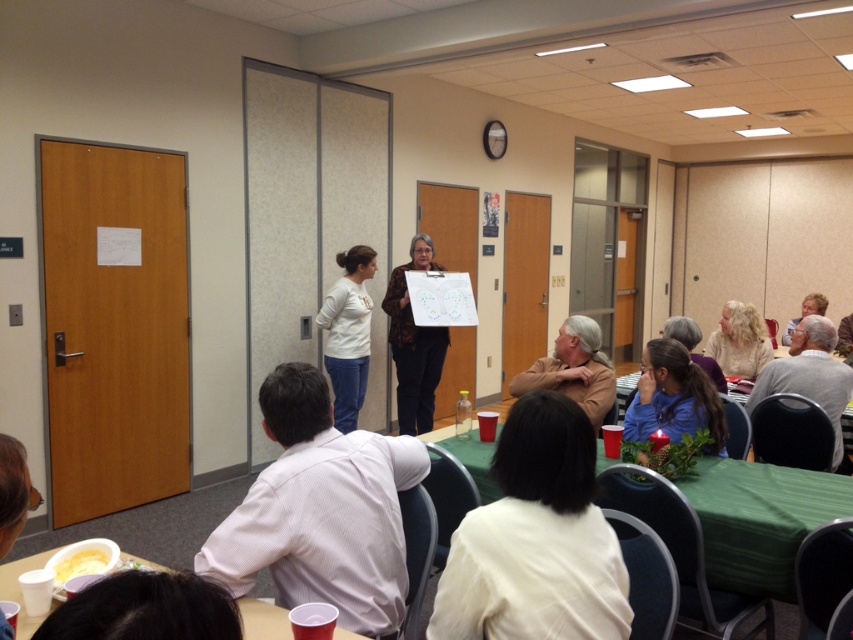
Does point (744, 465) come farther from viewer compared to point (706, 419)?

No, (744, 465) is closer to viewer.

Is green fabric table at lower center bigger than blue matte shirt at lower right?

No, green fabric table at lower center is not bigger than blue matte shirt at lower right.

I want to click on green fabric table at lower center, so click(x=759, y=518).

Does white matte shirt at lower center have a lesser width compared to blue matte shirt at lower right?

Indeed, white matte shirt at lower center has a lesser width compared to blue matte shirt at lower right.

Describe the element at coordinates (537, 540) in the screenshot. I see `white matte shirt at lower center` at that location.

Who is more forward, [509,493] or [637,406]?

Point [509,493] is in front.

The height and width of the screenshot is (640, 853). Identify the location of white matte shirt at lower center. (537, 540).

Based on the photo, can you confirm if white textured shirt at center is wider than green fabric table at lower center?

No, white textured shirt at center is not wider than green fabric table at lower center.

Between point (375, 451) and point (612, 461), which one is positioned in front?

Point (375, 451) is more forward.

Where is `white textured shirt at center`? This screenshot has height=640, width=853. white textured shirt at center is located at coordinates (320, 509).